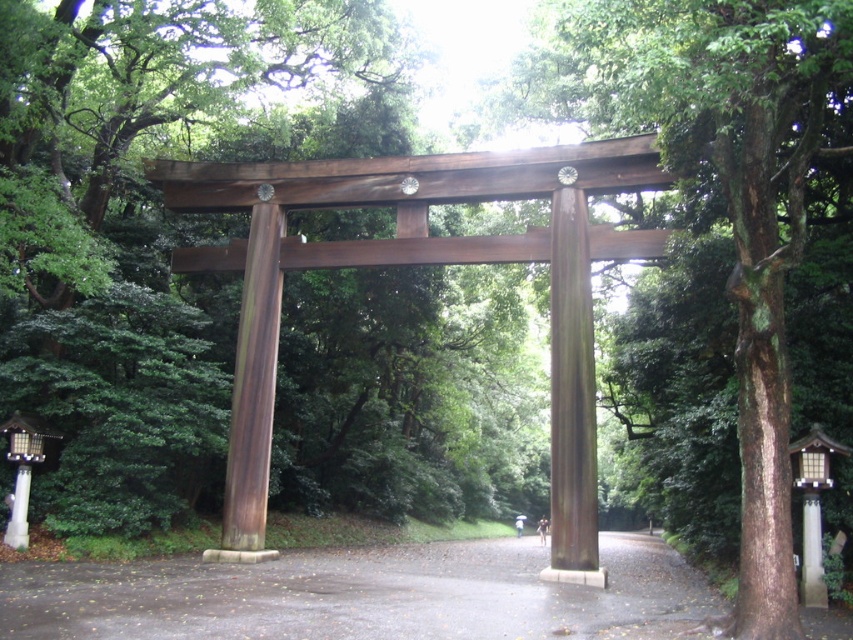
You are standing at the entrance of a Shinto shrine and see the glossy asphalt path at center. Based on its position coordinates, can you determine if the path leads directly to the torii gate?

The glossy asphalt path at center is positioned at point (361, 595), which is centrally located, so it likely leads directly to the torii gate.

You are standing in front of the torii gate and want to take a photo. You notice two points marked in the scene. Which point, point (86, 406) or point (757, 380), is closer to your camera lens?

Point (86, 406) is further to the camera than point (757, 380). Therefore, point (757, 380) is closer to the camera lens.

You are a visitor approaching the torii gate and want to walk through it. There is a glossy asphalt path at center and a brown polished wood post at center. Which object should you step on to pass through the gate?

You should step on the glossy asphalt path at center to pass through the gate since it is positioned under the brown polished wood post at center, allowing you to walk beneath the structure.